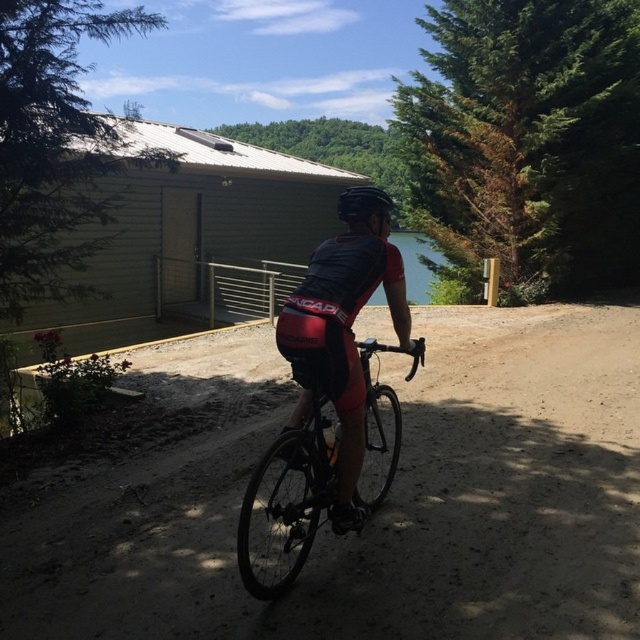
Is shiny black bike at center closer to camera compared to clear blue water at center?

That is True.

Does shiny black bike at center have a larger size compared to clear blue water at center?

Incorrect, shiny black bike at center is not larger than clear blue water at center.

Identify the location of shiny black bike at center. (284, 508).

Can you confirm if dirt/gravel road at center is thinner than clear blue water at center?

In fact, dirt/gravel road at center might be wider than clear blue water at center.

Is point (515, 515) farther from camera compared to point (406, 298)?

No, (515, 515) is in front of (406, 298).

The image size is (640, 640). What do you see at coordinates (385, 513) in the screenshot? I see `dirt/gravel road at center` at bounding box center [385, 513].

Image resolution: width=640 pixels, height=640 pixels. Identify the location of dirt/gravel road at center. (385, 513).

Is point (540, 317) farther from camera compared to point (355, 220)?

Yes, it is behind point (355, 220).

This screenshot has width=640, height=640. What do you see at coordinates (385, 513) in the screenshot?
I see `dirt/gravel road at center` at bounding box center [385, 513].

You are a GUI agent. You are given a task and a screenshot of the screen. Output one action in this format:
    pyautogui.click(x=<x>, y=<y>)
    Task: Click on the dirt/gravel road at center
    
    Given the screenshot: What is the action you would take?
    pyautogui.click(x=385, y=513)

I want to click on dirt/gravel road at center, so click(x=385, y=513).